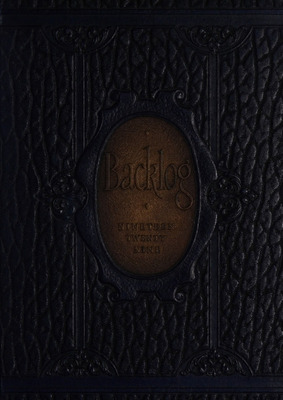
The width and height of the screenshot is (283, 400). Identify the location of ornate details around the oval. (74, 197), (226, 196), (108, 294), (112, 98), (173, 96).